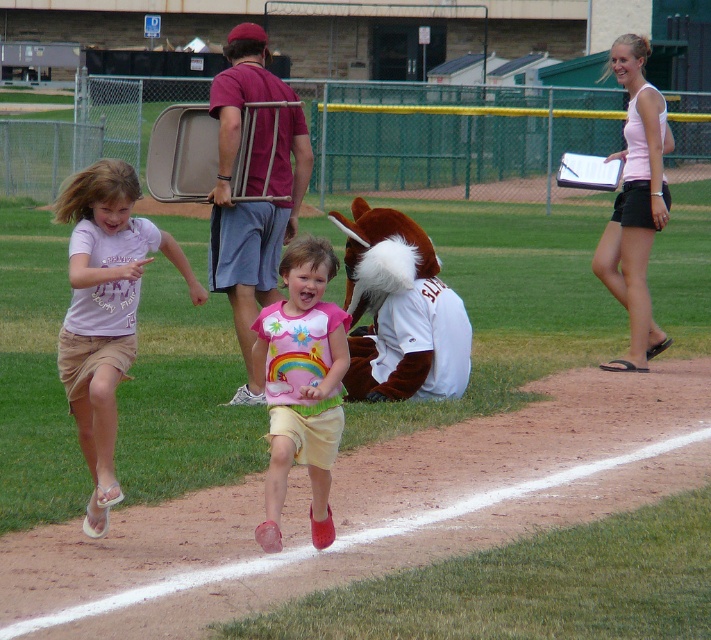
Question: Which is nearer to the matte pink shirt at center?

Choices:
 (A) pink fabric shirt at center
 (B) pink fabric shirt at right
 (C) beige cotton shorts at lower left

Answer: (A)

Question: Based on their relative distances, which object is farther from the pink fabric shirt at right?

Choices:
 (A) pink fabric shirt at center
 (B) matte pink shirt at center
 (C) beige cotton shorts at lower left

Answer: (C)

Question: Is pink fabric shirt at center positioned at the back of pink fabric shirt at right?

Choices:
 (A) yes
 (B) no

Answer: (B)

Question: Considering the real-world distances, which object is closest to the beige cotton shorts at lower left?

Choices:
 (A) pink fabric shirt at right
 (B) matte pink shirt at center
 (C) pink fabric shirt at center

Answer: (C)

Question: Is pink fabric shirt at center to the right of pink fabric shirt at right from the viewer's perspective?

Choices:
 (A) yes
 (B) no

Answer: (B)

Question: Is beige cotton shorts at lower left bigger than pink fabric shirt at right?

Choices:
 (A) no
 (B) yes

Answer: (A)